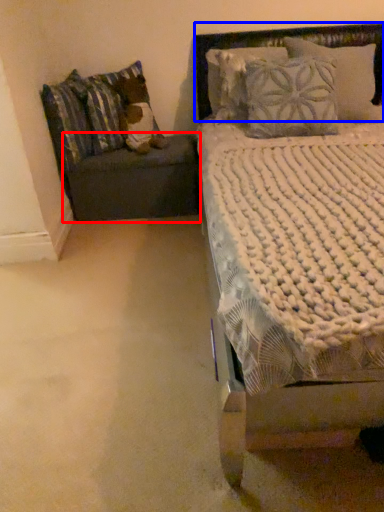
Question: Which object is closer to the camera taking this photo, table (highlighted by a red box) or headboard (highlighted by a blue box)?

Choices:
 (A) table
 (B) headboard

Answer: (B)